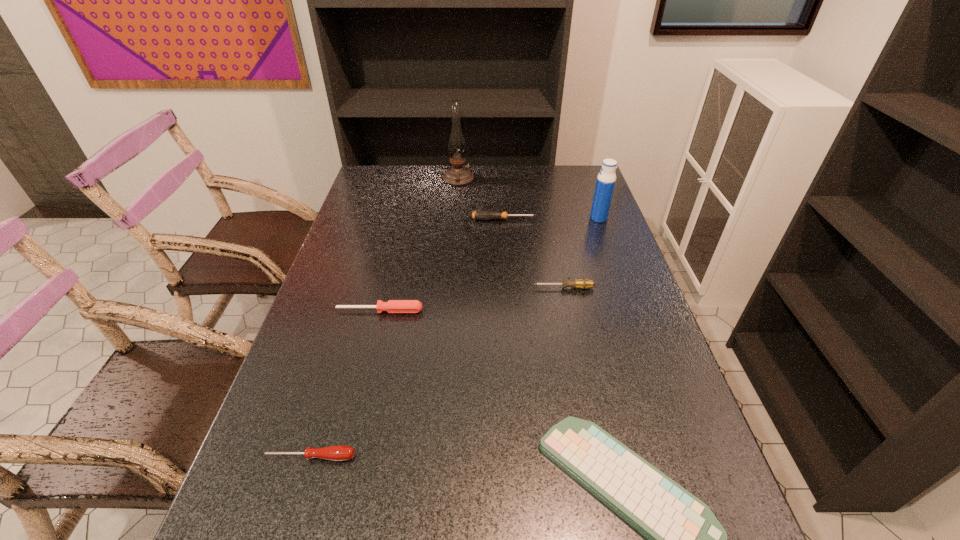
You are a GUI agent. You are given a task and a screenshot of the screen. Output one action in this format:
    pyautogui.click(x=<x>, y=<y>)
    Task: Click on the free spot between the fourth farthest object and the farthest screwdriver
    
    Given the screenshot: What is the action you would take?
    pyautogui.click(x=534, y=254)

Identify which object is the sixth closest to the fourth nearest object. Please provide its 2D coordinates. Your answer should be formatted as a tuple, i.e. [(x, y)], where the tuple contains the x and y coordinates of a point satisfying the conditions above.

[(339, 452)]

Where is `object that is the second closest to the sixth shortest object`? This screenshot has height=540, width=960. object that is the second closest to the sixth shortest object is located at coordinates (582, 283).

I want to click on screwdriver that is the closest to the farthest screwdriver, so click(x=582, y=283).

Locate an element on the screen. Image resolution: width=960 pixels, height=540 pixels. the fourth closest screwdriver to the water bottle is located at coordinates (339, 452).

Find the location of a particular element. vacant position in the image that satisfies the following two spatial constraints: 1. on the back side of the fifth farthest object; 2. on the left side of the water bottle is located at coordinates (402, 218).

Where is `vacant region that satisfies the following two spatial constraints: 1. on the back side of the farthest screwdriver; 2. on the left side of the third farthest screwdriver`? The width and height of the screenshot is (960, 540). vacant region that satisfies the following two spatial constraints: 1. on the back side of the farthest screwdriver; 2. on the left side of the third farthest screwdriver is located at coordinates (402, 220).

Locate an element on the screen. vacant space that satisfies the following two spatial constraints: 1. on the back side of the farthest screwdriver; 2. on the right side of the fifth farthest object is located at coordinates (402, 220).